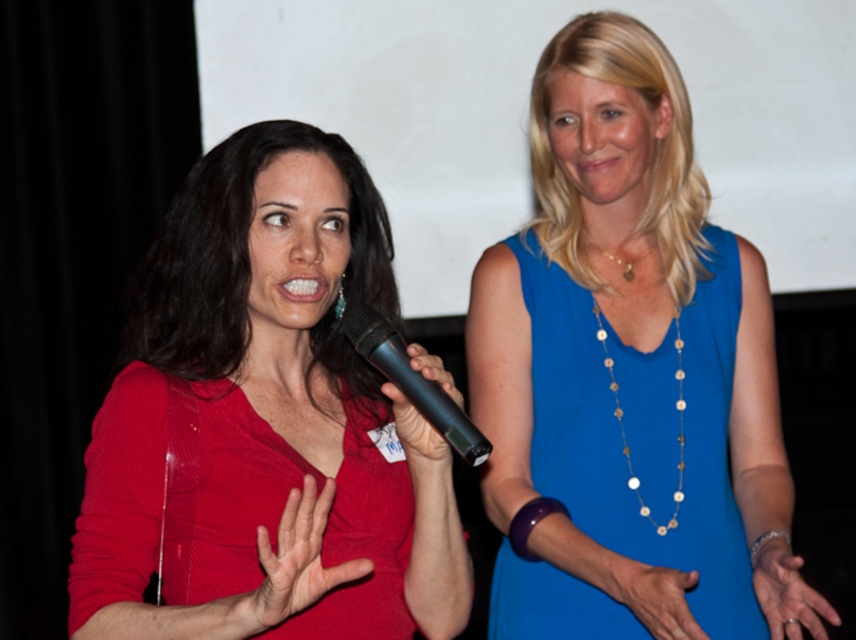
From the picture: You are a sound technician setting up for a presentation. You have two microphones available. The black plastic microphone at center and the black matte microphone at center. Which one is wider?

The black plastic microphone at center is wider than the black matte microphone at center according to the description.

You are a photographer setting up for a portrait session. You need to ensure that the blue silk dress at upper right and the matte red hand at center are both visible in the frame. Based on their sizes, which object should you focus on first to ensure proper composition?

The blue silk dress at upper right has a greater height compared to the matte red hand at center, so you should focus on the blue silk dress at upper right first to ensure it is properly framed before adjusting for the smaller matte red hand at center.

Consider the image. You are a photographer positioned in front of the two women. You want to take a photo that includes both women and the black plastic microphone at center. Based on their positions, where should you aim your camera to ensure all three are in frame?

You should aim your camera at the center of the image, where the black plastic microphone at center is located at point (412,380). This central position will ensure both women and the microphone are included in the frame.